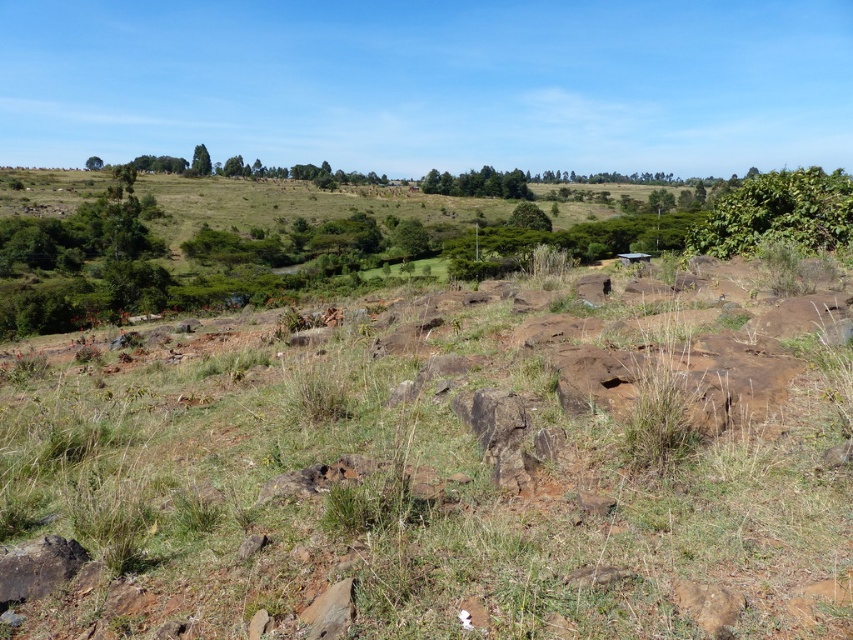
Identify the location of green grassy at center. This screenshot has height=640, width=853. (440, 474).

Does green grassy at center appear on the left side of green leafy tree at upper left?

No, green grassy at center is not to the left of green leafy tree at upper left.

Image resolution: width=853 pixels, height=640 pixels. Describe the element at coordinates (440, 474) in the screenshot. I see `green grassy at center` at that location.

Locate an element on the screen. This screenshot has height=640, width=853. green grassy at center is located at coordinates (440, 474).

Can you confirm if green grassy at center is smaller than green leafy trees at center?

Yes.

Is point (612, 520) closer to camera compared to point (433, 180)?

That is True.

Between point (155, 508) and point (498, 195), which one is positioned in front?

Point (155, 508) is more forward.

The image size is (853, 640). Find the location of `green grassy at center`. green grassy at center is located at coordinates coord(440,474).

Who is taller, green leafy bush at upper right or green leafy trees at center?

Standing taller between the two is green leafy trees at center.

Looking at this image, is green leafy bush at upper right smaller than green leafy trees at center?

Correct, green leafy bush at upper right occupies less space than green leafy trees at center.

Between point (846, 184) and point (485, 189), which one is positioned in front?

Point (846, 184) is more forward.

Locate an element on the screen. green leafy bush at upper right is located at coordinates (776, 212).